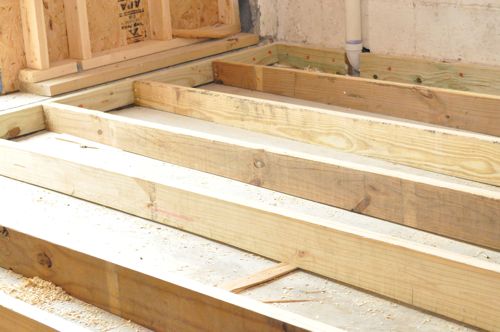
Locate an element on the screen. brown plywood is located at coordinates (5, 52).